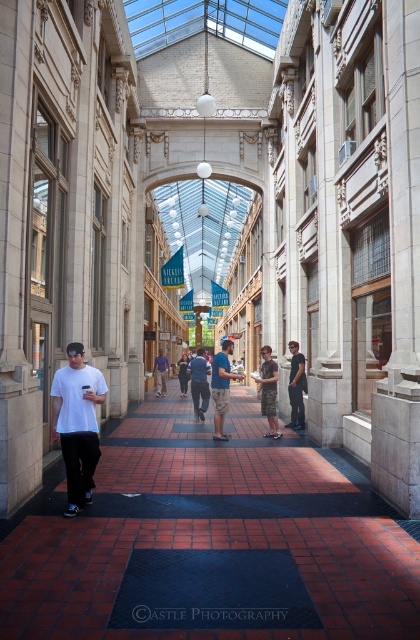
Is brown tile pavement at center above camouflage shorts at center?

Incorrect, brown tile pavement at center is not positioned above camouflage shorts at center.

Who is more distant from viewer, (277, 470) or (217, 412)?

The point (217, 412) is more distant.

Identify the location of brown tile pavement at center. (214, 536).

Which is in front, point (204, 621) or point (204, 388)?

Point (204, 621) is in front.

Is dark blue mat at center thinner than dark blue jeans at center?

No, dark blue mat at center is not thinner than dark blue jeans at center.

You are a GUI agent. You are given a task and a screenshot of the screen. Output one action in this format:
    pyautogui.click(x=<x>, y=<y>)
    Task: Click on the dark blue mat at center
    The image size is (420, 640).
    Given the screenshot: What is the action you would take?
    pyautogui.click(x=212, y=589)

Between camouflage shorts at center and dark blue jeans at center, which one is positioned lower?

dark blue jeans at center

Is point (223, 436) closer to viewer compared to point (202, 348)?

That is True.

In order to click on camouflage shorts at center in this screenshot , I will do `click(222, 387)`.